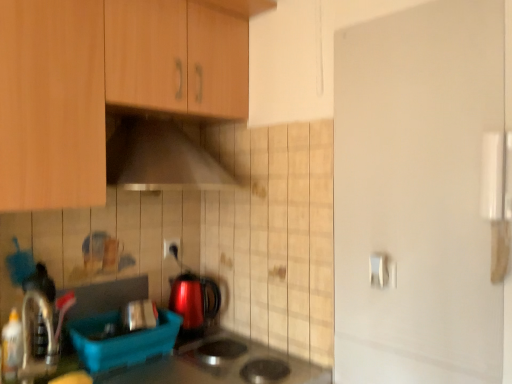
Question: Does wooden cabinet at upper left have a lesser width compared to glossy metallic kettle at center?

Choices:
 (A) yes
 (B) no

Answer: (B)

Question: Is wooden cabinet at upper left smaller than glossy metallic kettle at center?

Choices:
 (A) no
 (B) yes

Answer: (A)

Question: Is glossy metallic kettle at center a part of wooden cabinet at upper left?

Choices:
 (A) yes
 (B) no

Answer: (B)

Question: Does wooden cabinet at upper left have a lesser height compared to glossy metallic kettle at center?

Choices:
 (A) no
 (B) yes

Answer: (A)

Question: Is the position of wooden cabinet at upper left less distant than that of glossy metallic kettle at center?

Choices:
 (A) no
 (B) yes

Answer: (B)

Question: Relative to metallic silver range hood at upper center, is white glossy door handle at upper right in front or behind?

Choices:
 (A) behind
 (B) front

Answer: (A)

Question: From a real-world perspective, relative to metallic silver range hood at upper center, is white glossy door handle at upper right vertically above or below?

Choices:
 (A) above
 (B) below

Answer: (B)

Question: Based on their sizes in the image, would you say white glossy door handle at upper right is bigger or smaller than metallic silver range hood at upper center?

Choices:
 (A) small
 (B) big

Answer: (A)

Question: In the image, is white glossy door handle at upper right on the left side or the right side of metallic silver range hood at upper center?

Choices:
 (A) left
 (B) right

Answer: (B)

Question: Is metallic silver range hood at upper center taller or shorter than white glossy door handle at upper right?

Choices:
 (A) tall
 (B) short

Answer: (A)

Question: In the image, is metallic silver range hood at upper center on the left side or the right side of white glossy door handle at upper right?

Choices:
 (A) left
 (B) right

Answer: (A)

Question: Looking at their shapes, would you say metallic silver range hood at upper center is wider or thinner than white glossy door handle at upper right?

Choices:
 (A) wide
 (B) thin

Answer: (A)

Question: Is point (155, 182) closer or farther from the camera than point (373, 281)?

Choices:
 (A) farther
 (B) closer

Answer: (A)

Question: Is point (142, 326) closer or farther from the camera than point (151, 342)?

Choices:
 (A) farther
 (B) closer

Answer: (A)

Question: Considering the positions of metallic silver toaster at lower center, the first appliance from the back, and blue plastic container at lower left, the second appliance when ordered from back to front, in the image, is metallic silver toaster at lower center, the first appliance from the back, taller or shorter than blue plastic container at lower left, the second appliance when ordered from back to front,?

Choices:
 (A) tall
 (B) short

Answer: (A)